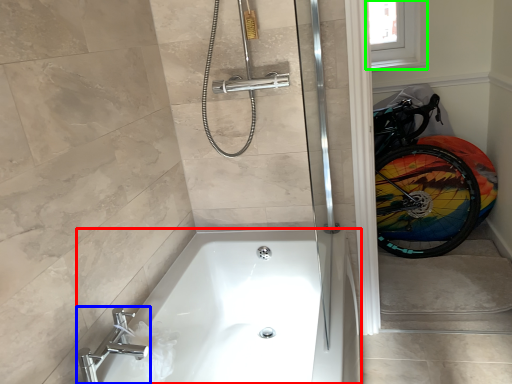
Question: Which object is positioned farthest from bathtub (highlighted by a red box)? Select from tap (highlighted by a blue box) and window screen (highlighted by a green box).

Choices:
 (A) tap
 (B) window screen

Answer: (B)